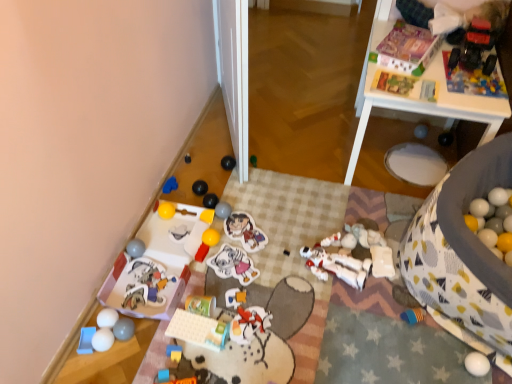
The width and height of the screenshot is (512, 384). I want to click on vacant space in front of white matte plush at center, which ranks as the 23th toy in left-to-right order, so click(385, 311).